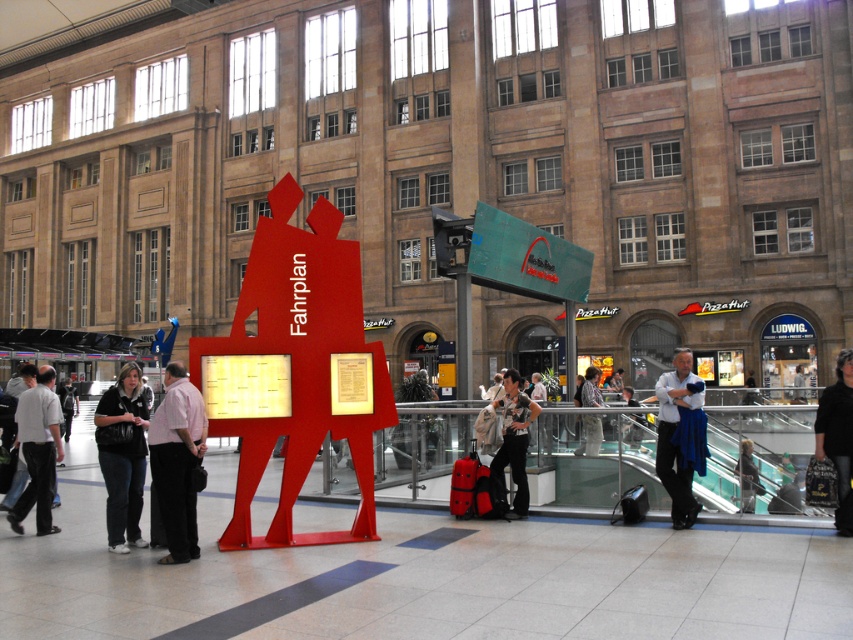
You are a traveler in the train station and you see a white shirt at center and a dark brown leather jacket at lower right. Which clothing item is closer to the left side of the station?

The white shirt at center is positioned on the left side of the dark brown leather jacket at lower right, so it is closer to the left side of the station.

You are an observer in the train station. You see a white shirt at center and a dark brown leather jacket at lower right. Which clothing item takes up more visual space in the scene?

The white shirt at center is bigger than the dark brown leather jacket at lower right, so the white shirt at center takes up more visual space in the scene.

You are standing in the train station and see the red Fahrplan figure. Where is the white shirt at center located relative to the red figure?

The white shirt at center is located to the right of the red Fahrplan figure.